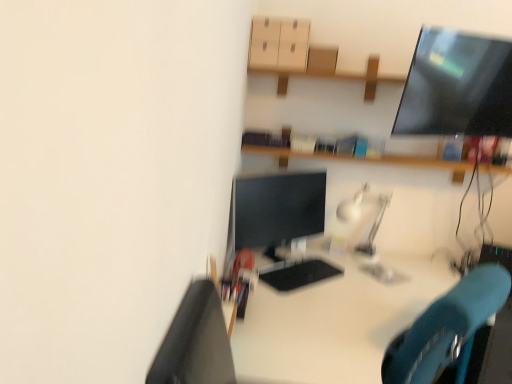
This screenshot has width=512, height=384. What are the coordinates of `satin silver lamp at center` in the screenshot? It's located at (365, 227).

What do you see at coordinates (279, 224) in the screenshot?
I see `matte black monitor at center` at bounding box center [279, 224].

Where is `satin silver lamp at center`? satin silver lamp at center is located at coordinates (365, 227).

Based on their sizes in the image, would you say matte black monitor at center is bigger or smaller than satin silver lamp at center?

Clearly, matte black monitor at center is larger in size than satin silver lamp at center.

Is matte black monitor at center facing away from satin silver lamp at center?

That's not correct — matte black monitor at center is not looking away from satin silver lamp at center.

Considering the relative positions of matte black monitor at center and satin silver lamp at center in the image provided, is matte black monitor at center to the left of satin silver lamp at center from the viewer's perspective?

Yes.

From a real-world perspective, which object stands above the other?

matte black monitor at center, from a real-world perspective.

From a real-world perspective, is white glossy desk at center positioned above or below satin silver lamp at center?

white glossy desk at center is situated lower than satin silver lamp at center in the real world.

In the scene shown: Can you confirm if white glossy desk at center is shorter than satin silver lamp at center?

No, white glossy desk at center is not shorter than satin silver lamp at center.

Which is less distant, (x=400, y=258) or (x=362, y=211)?

Clearly, point (x=400, y=258) is more distant from the camera than point (x=362, y=211).

Is white glossy desk at center not close to matte cardboard drawer at upper center?

white glossy desk at center is far away from matte cardboard drawer at upper center.

Considering the relative sizes of white glossy desk at center and matte cardboard drawer at upper center in the image provided, is white glossy desk at center shorter than matte cardboard drawer at upper center?

Incorrect, the height of white glossy desk at center does not fall short of that of matte cardboard drawer at upper center.

From the image's perspective, which object appears higher, white glossy desk at center or matte cardboard drawer at upper center?

matte cardboard drawer at upper center appears higher in the image.

Which object is positioned more to the right, matte cardboard drawer at upper center or white glossy desk at center?

Positioned to the right is white glossy desk at center.

In the scene shown: Are matte cardboard drawer at upper center and white glossy desk at center making contact?

No, matte cardboard drawer at upper center is not with white glossy desk at center.

Could you tell me if matte cardboard drawer at upper center is turned towards white glossy desk at center?

No, matte cardboard drawer at upper center does not turn towards white glossy desk at center.

Based on the photo, which point is more forward, (x=255, y=60) or (x=354, y=282)?

Point (x=255, y=60)

Considering the positions of point (251, 41) and point (277, 276), is point (251, 41) closer or farther from the camera than point (277, 276)?

Point (251, 41).

Considering the sizes of objects matte cardboard drawer at upper center and matte black monitor at center in the image provided, who is shorter, matte cardboard drawer at upper center or matte black monitor at center?

With less height is matte cardboard drawer at upper center.

Would you say matte cardboard drawer at upper center is outside matte black monitor at center?

Indeed, matte cardboard drawer at upper center is completely outside matte black monitor at center.

Which object is closer to the camera, matte cardboard drawer at upper center or matte black monitor at center?

matte black monitor at center is more forward.

From a real-world perspective, is satin silver lamp at center under white glossy desk at center?

No.

Which is farther from the camera, (x=362, y=199) or (x=413, y=322)?

The point (x=362, y=199) is farther.

Between satin silver lamp at center and white glossy desk at center, which one has more height?

white glossy desk at center is taller.

Considering their positions, is satin silver lamp at center located in front of or behind white glossy desk at center?

satin silver lamp at center is positioned farther from the viewer than white glossy desk at center.

Is satin silver lamp at center in front of or behind matte black monitor at center in the image?

satin silver lamp at center is positioned farther from the viewer than matte black monitor at center.

Based on the photo, considering the sizes of satin silver lamp at center and matte black monitor at center in the image, is satin silver lamp at center bigger or smaller than matte black monitor at center?

Clearly, satin silver lamp at center is smaller in size than matte black monitor at center.

Identify the location of table lamp below the matte black monitor at center (from the image's perspective). The image size is (512, 384). (365, 227).

Where is `table lamp above the white glossy desk at center (from a real-world perspective)`? This screenshot has height=384, width=512. table lamp above the white glossy desk at center (from a real-world perspective) is located at coordinates (365, 227).

From the image, which object appears to be farther from matte cardboard drawer at upper center, matte black monitor at center or white glossy desk at center?

white glossy desk at center is further to matte cardboard drawer at upper center.

Consider the image. When comparing their distances from matte cardboard drawer at upper center, does satin silver lamp at center or white glossy desk at center seem closer?

Among the two, satin silver lamp at center is located nearer to matte cardboard drawer at upper center.

From the image, which object appears to be nearer to white glossy desk at center, satin silver lamp at center or matte black monitor at center?

The object closer to white glossy desk at center is matte black monitor at center.

From the image, which object appears to be nearer to white glossy desk at center, matte cardboard drawer at upper center or satin silver lamp at center?

satin silver lamp at center.

Estimate the real-world distances between objects in this image. Which object is closer to satin silver lamp at center, white glossy desk at center or matte black monitor at center?

matte black monitor at center lies closer to satin silver lamp at center than the other object.

From the image, which object appears to be farther from satin silver lamp at center, matte cardboard drawer at upper center or white glossy desk at center?

The object further to satin silver lamp at center is matte cardboard drawer at upper center.

Estimate the real-world distances between objects in this image. Which object is closer to matte black monitor at center, white glossy desk at center or matte cardboard drawer at upper center?

white glossy desk at center.

Based on the photo, considering their positions, is matte black monitor at center positioned closer to matte cardboard drawer at upper center than satin silver lamp at center?

matte black monitor at center is positioned closer to the anchor matte cardboard drawer at upper center.

The image size is (512, 384). I want to click on desktop computer that lies between matte cardboard drawer at upper center and white glossy desk at center from top to bottom, so click(279, 224).

Locate an element on the screen. The image size is (512, 384). desktop computer between white glossy desk at center and satin silver lamp at center in the front-back direction is located at coordinates (279, 224).

I want to click on desktop computer between matte cardboard drawer at upper center and satin silver lamp at center vertically, so click(279, 224).

The image size is (512, 384). I want to click on table lamp between matte cardboard drawer at upper center and white glossy desk at center in the vertical direction, so click(365, 227).